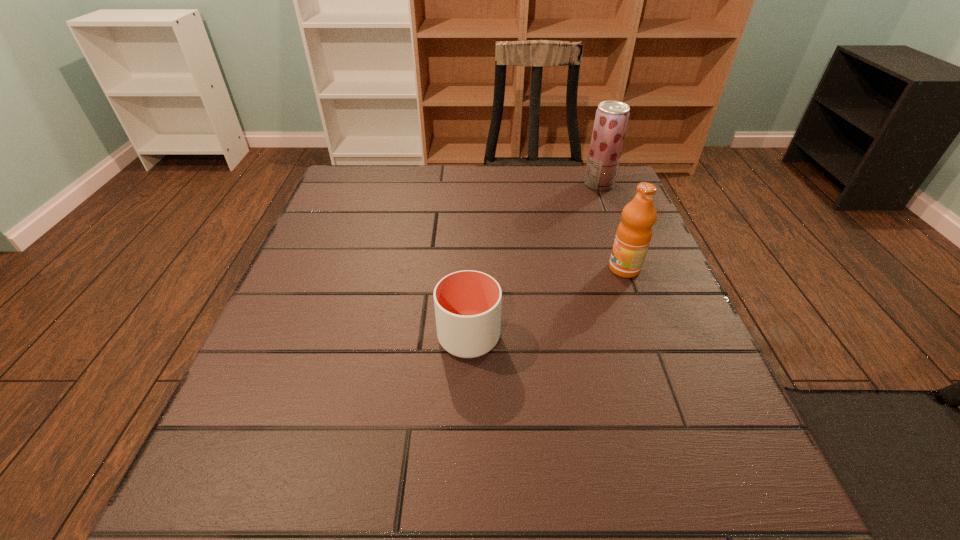
Where is `empty space that is in between the farthest object and the nearer fruit juice`? empty space that is in between the farthest object and the nearer fruit juice is located at coordinates (612, 226).

At what (x,y) coordinates should I click in order to perform the action: click on vacant area that lies between the nearer fruit juice and the nearest object. Please return your answer as a coordinate pair (x, y). Image resolution: width=960 pixels, height=540 pixels. Looking at the image, I should click on (546, 303).

At what (x,y) coordinates should I click in order to perform the action: click on vacant area that lies between the cup and the farthest object. Please return your answer as a coordinate pair (x, y). Looking at the image, I should click on (534, 261).

Identify the location of free area in between the farther fruit juice and the leftmost object. (534, 261).

I want to click on free space between the farthest object and the nearest object, so click(x=534, y=261).

Image resolution: width=960 pixels, height=540 pixels. In order to click on vacant area between the leftmost object and the farther fruit juice in this screenshot , I will do 534,261.

This screenshot has height=540, width=960. Find the location of `free space between the nearer fruit juice and the farther fruit juice`. free space between the nearer fruit juice and the farther fruit juice is located at coordinates (612, 226).

Point out which object is positioned as the nearest to the nearer fruit juice. Please provide its 2D coordinates. Your answer should be formatted as a tuple, i.e. [(x, y)], where the tuple contains the x and y coordinates of a point satisfying the conditions above.

[(467, 303)]

Find the location of a particular element. The image size is (960, 540). object that is the nearest to the nearer fruit juice is located at coordinates (467, 303).

Find the location of `free space that satisfies the following two spatial constraints: 1. on the label side of the nearer fruit juice; 2. on the front side of the shortest object`. free space that satisfies the following two spatial constraints: 1. on the label side of the nearer fruit juice; 2. on the front side of the shortest object is located at coordinates (650, 337).